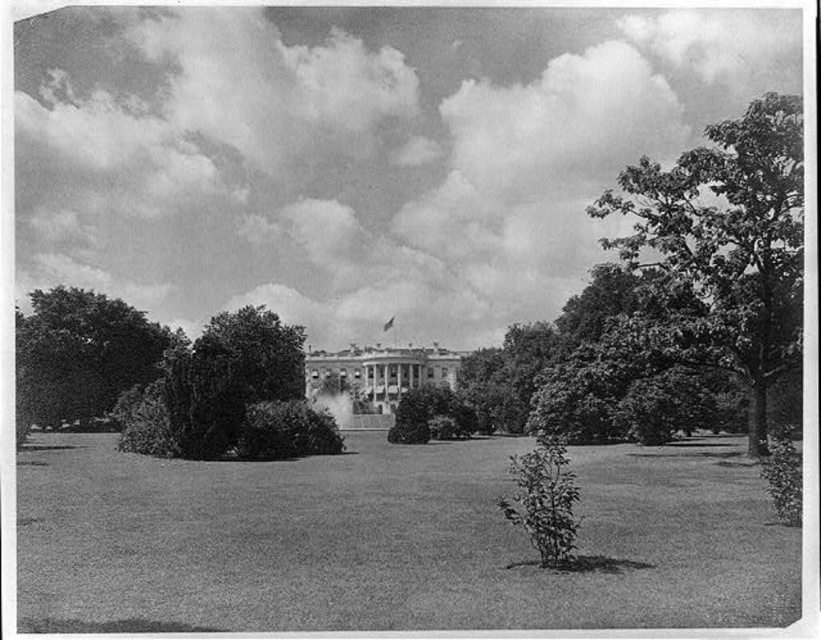
You are standing in the White House lawn and want to walk from the dark green leafy tree at left to the dark green leafy bush at lower center. Which direction should you head to reach the bush?

The dark green leafy tree at left is further to the viewer than the dark green leafy bush at lower center, so you should head forward towards the bush to reach it.

You are a landscape architect designing a new garden layout. You need to place a new statue between the smooth green tree at right and the dark green leafy tree at left. Considering their sizes, which tree should the statue be closer to and why?

The statue should be closer to the dark green leafy tree at left because the smooth green tree at right is larger in size, so placing the statue closer to the smaller tree balances the composition.